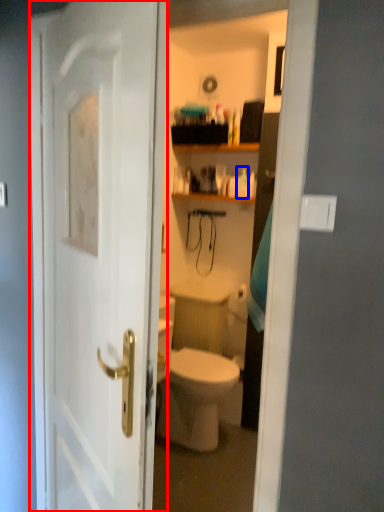
Question: Which object appears farthest to the camera in this image, door (highlighted by a red box) or toiletry (highlighted by a blue box)?

Choices:
 (A) door
 (B) toiletry

Answer: (B)